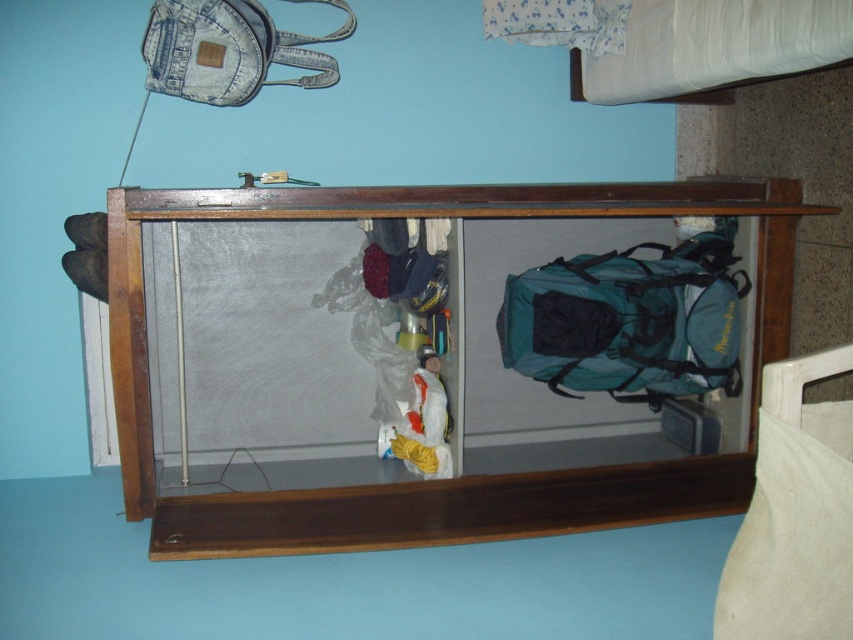
Does white cotton pillow at lower right have a smaller size compared to denim backpack at upper left?

Correct, white cotton pillow at lower right occupies less space than denim backpack at upper left.

Between white cotton pillow at lower right and denim backpack at upper left, which one appears on the right side from the viewer's perspective?

From the viewer's perspective, white cotton pillow at lower right appears more on the right side.

The image size is (853, 640). In order to click on white cotton pillow at lower right in this screenshot , I will do `click(793, 532)`.

Is teal fabric backpack at center-right taller than white cotton pillow at lower right?

Indeed, teal fabric backpack at center-right has a greater height compared to white cotton pillow at lower right.

Can you confirm if teal fabric backpack at center-right is positioned to the right of white cotton pillow at lower right?

No, teal fabric backpack at center-right is not to the right of white cotton pillow at lower right.

Is point (613, 257) farther from viewer compared to point (833, 433)?

Yes, it is.

The image size is (853, 640). What are the coordinates of `teal fabric backpack at center-right` in the screenshot? It's located at (630, 321).

In the scene shown: Which of these two, wooden shelf at center or teal fabric backpack at center-right, stands shorter?

teal fabric backpack at center-right

Is wooden shelf at center closer to camera compared to teal fabric backpack at center-right?

Yes, it is in front of teal fabric backpack at center-right.

What do you see at coordinates (456, 477) in the screenshot? I see `wooden shelf at center` at bounding box center [456, 477].

This screenshot has width=853, height=640. What are the coordinates of `wooden shelf at center` in the screenshot? It's located at (456, 477).